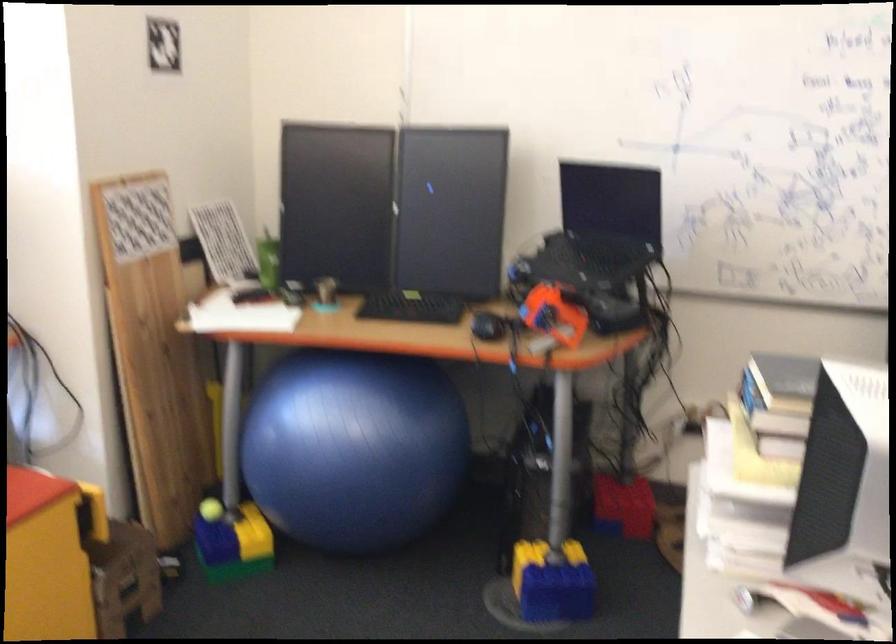
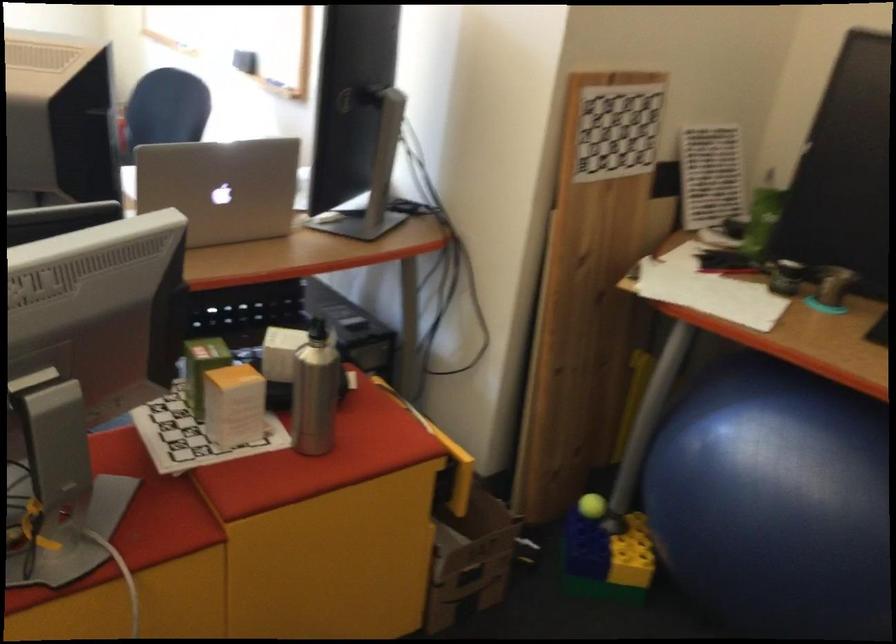
Question: Based on the continuous images, in which direction is the camera rotating? Reply with the corresponding letter.

Choices:
 (A) Left
 (B) Right
 (C) Up
 (D) Down

Answer: (A)